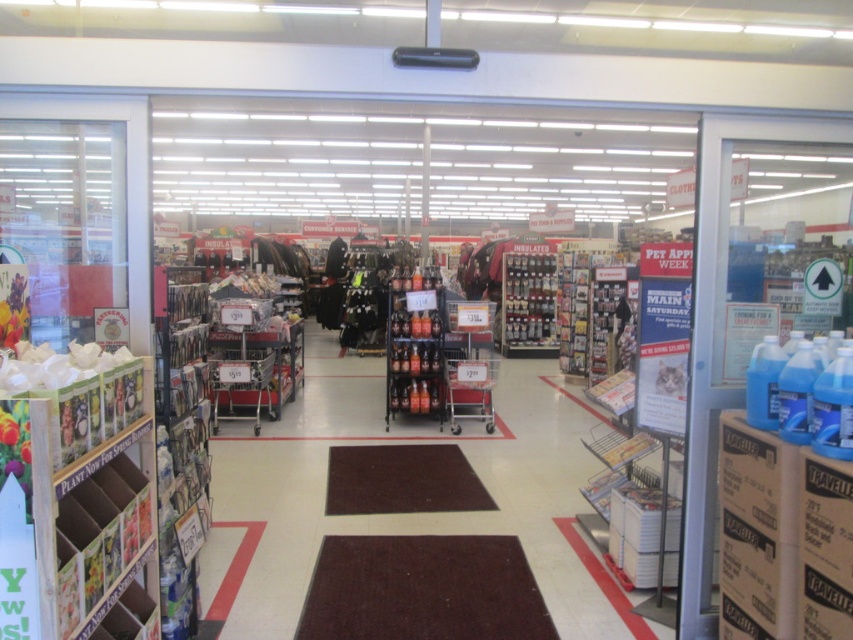
Who is lower down, metallic silver chocolates at center or silver metallic shopping cart at center?

silver metallic shopping cart at center is lower down.

Between metallic silver chocolates at center and silver metallic shopping cart at center, which one appears on the left side from the viewer's perspective?

Positioned to the left is silver metallic shopping cart at center.

Describe the element at coordinates (527, 301) in the screenshot. I see `metallic silver chocolates at center` at that location.

Find the location of a particular element. metallic silver chocolates at center is located at coordinates (527, 301).

You are a GUI agent. You are given a task and a screenshot of the screen. Output one action in this format:
    pyautogui.click(x=<x>, y=<y>)
    Task: Click on the metallic silver bottles at center
    
    Given the screenshot: What is the action you would take?
    pyautogui.click(x=415, y=353)

Who is positioned more to the right, metallic silver bottles at center or silver metallic shopping cart at center?

silver metallic shopping cart at center is more to the right.

Find the location of a particular element. This screenshot has width=853, height=640. metallic silver bottles at center is located at coordinates (415, 353).

Who is shorter, metallic silver shopping cart at center or silver metallic shopping cart at center?

metallic silver shopping cart at center

Is metallic silver shopping cart at center below silver metallic shopping cart at center?

Indeed, metallic silver shopping cart at center is positioned under silver metallic shopping cart at center.

Locate an element on the screen. The width and height of the screenshot is (853, 640). metallic silver shopping cart at center is located at coordinates (405, 509).

Where is `metallic silver shopping cart at center`? This screenshot has height=640, width=853. metallic silver shopping cart at center is located at coordinates (405, 509).